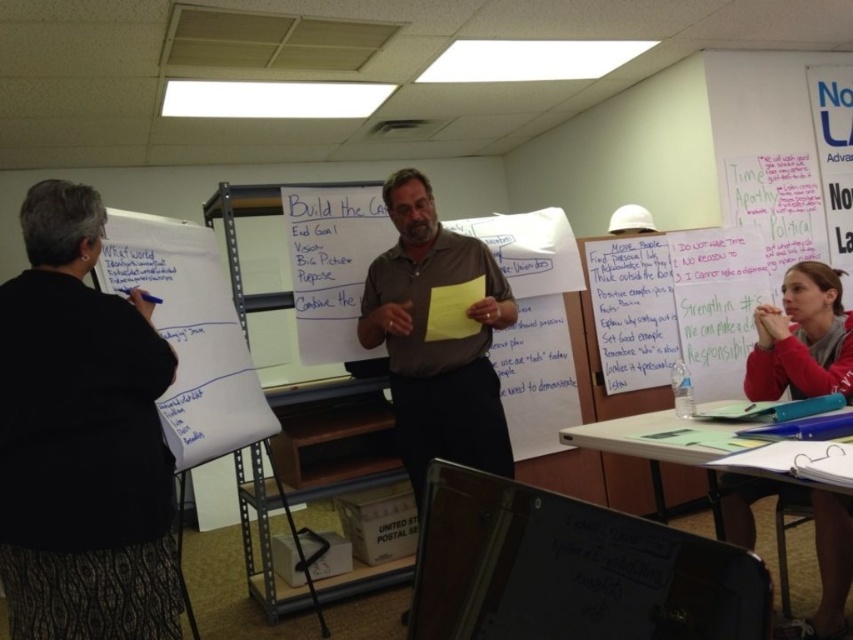
Between black textured sweater at left and white paper at lower right, which one is positioned higher?

black textured sweater at left is higher up.

Which is below, black textured sweater at left or white paper at lower right?

white paper at lower right is below.

Measure the distance between point (45, 234) and camera.

Point (45, 234) is 5.44 feet away from camera.

Find the location of a particular element. black textured sweater at left is located at coordinates (80, 440).

Is brown smooth shirt at center above red fleece jacket at lower right?

Actually, brown smooth shirt at center is below red fleece jacket at lower right.

Who is more distant from viewer, (x=450, y=392) or (x=827, y=636)?

The point (x=450, y=392) is behind.

The image size is (853, 640). Identify the location of brown smooth shirt at center. (438, 340).

Is black textured sweater at left to the left of red fleece jacket at lower right from the viewer's perspective?

Correct, you'll find black textured sweater at left to the left of red fleece jacket at lower right.

Can you confirm if black textured sweater at left is shorter than red fleece jacket at lower right?

No.

Image resolution: width=853 pixels, height=640 pixels. Describe the element at coordinates (80, 440) in the screenshot. I see `black textured sweater at left` at that location.

Identify the location of black textured sweater at left. (80, 440).